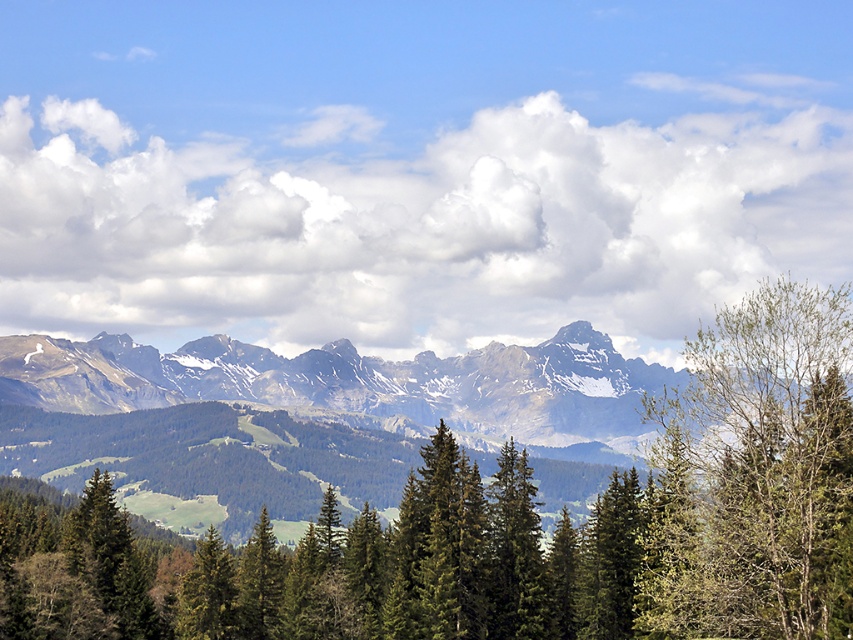
You are planning a hiking route and need to know the relative sizes of the gray rocky mountain range at center and the green matte tree at lower left. Which one is wider?

The gray rocky mountain range at center is wider than the green matte tree at lower left.